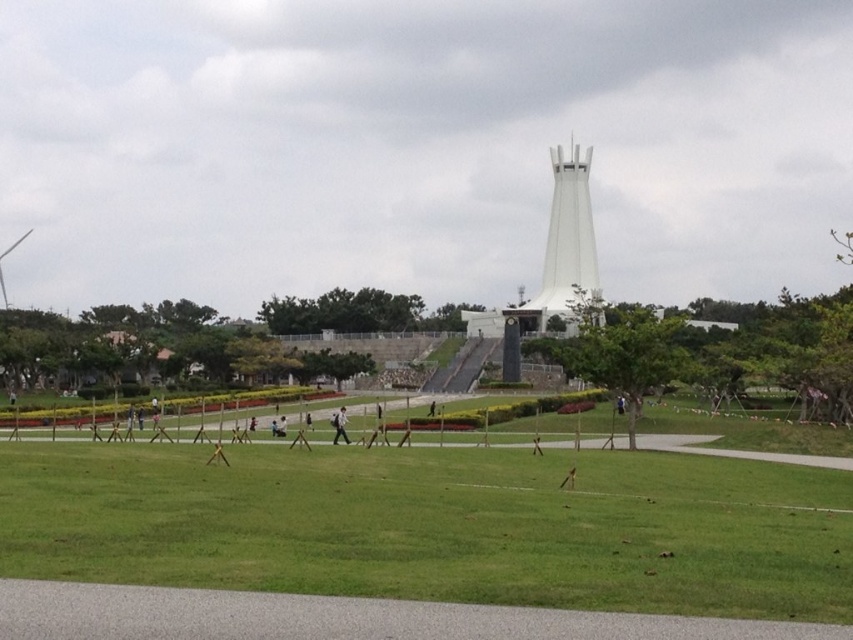
Who is more forward, (96, 541) or (567, 176)?

Point (96, 541) is in front.

Is green grass at center shorter than white glossy tower at center?

Yes.

The image size is (853, 640). In order to click on green grass at center in this screenshot , I will do `click(437, 525)`.

The width and height of the screenshot is (853, 640). I want to click on green grass at center, so click(x=437, y=525).

Who is higher up, green grass at center or white fabric person at center?

green grass at center

Between green grass at center and white fabric person at center, which one is positioned lower?

white fabric person at center is below.

Does point (41, 516) come in front of point (337, 436)?

Yes, it is in front of point (337, 436).

You are a GUI agent. You are given a task and a screenshot of the screen. Output one action in this format:
    pyautogui.click(x=<x>, y=<y>)
    Task: Click on the green grass at center
    The image size is (853, 640).
    Given the screenshot: What is the action you would take?
    pyautogui.click(x=437, y=525)

Does white glossy tower at center have a greater width compared to white fabric person at center?

Yes, white glossy tower at center is wider than white fabric person at center.

Does point (572, 244) come behind point (335, 440)?

Yes, it is behind point (335, 440).

Locate an element on the screen. white glossy tower at center is located at coordinates (566, 243).